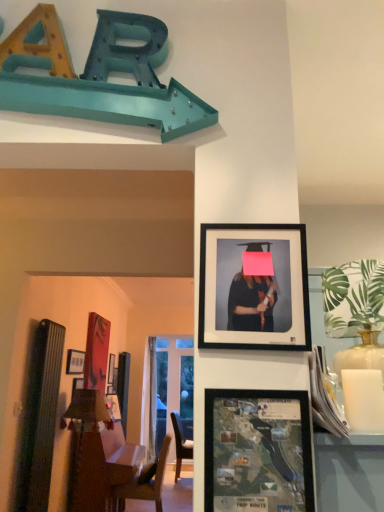
What do you see at coordinates (254, 287) in the screenshot?
I see `matte black frame at upper center, which is the third picture frame from bottom to top` at bounding box center [254, 287].

You are a GUI agent. You are given a task and a screenshot of the screen. Output one action in this format:
    pyautogui.click(x=<x>, y=<y>)
    Task: Click on the wooden bulletin board at left
    Image resolution: width=384 pixels, height=512 pixels.
    Given the screenshot: What is the action you would take?
    pyautogui.click(x=39, y=418)

Image resolution: width=384 pixels, height=512 pixels. What do you see at coordinates (258, 451) in the screenshot? I see `matte plastic map at center, which appears as the third picture frame when viewed from the back` at bounding box center [258, 451].

Find the location of a particular element. Image resolution: width=384 pixels, height=512 pixels. matte black frame at upper center, the 2th picture frame from the back is located at coordinates (254, 287).

Is matte plastic map at center, the 2th picture frame in the bottom-to-top sequence, taller or shorter than matte black frame at upper center, which is the third picture frame from bottom to top?

matte plastic map at center, the 2th picture frame in the bottom-to-top sequence, is shorter than matte black frame at upper center, which is the third picture frame from bottom to top.

Is matte plastic map at center, which is the first picture frame from front to back, next to matte black frame at upper center, marked as the 2th picture frame in a front-to-back arrangement?

matte plastic map at center, which is the first picture frame from front to back, and matte black frame at upper center, marked as the 2th picture frame in a front-to-back arrangement, are not in contact.

Relative to matte black frame at upper center, positioned as the first picture frame in top-to-bottom order, is matte plastic map at center, which appears as the 2th picture frame when viewed from the top, in front or behind?

In the image, matte plastic map at center, which appears as the 2th picture frame when viewed from the top, appears in front of matte black frame at upper center, positioned as the first picture frame in top-to-bottom order.

From the image's perspective, would you say matte plastic map at center, which appears as the third picture frame when viewed from the back, is positioned over matte black frame at upper center, positioned as the 1th picture frame in right-to-left order?

No, from the image's perspective, matte plastic map at center, which appears as the third picture frame when viewed from the back, is not on top of matte black frame at upper center, positioned as the 1th picture frame in right-to-left order.

Is matte black frame at upper center, positioned as the 1th picture frame in right-to-left order, wider or thinner than matte black picture frame at upper left, positioned as the 1th picture frame in bottom-to-top order?

Clearly, matte black frame at upper center, positioned as the 1th picture frame in right-to-left order, has less width compared to matte black picture frame at upper left, positioned as the 1th picture frame in bottom-to-top order.

From the image's perspective, does matte black frame at upper center, marked as the 2th picture frame in a front-to-back arrangement, appear lower than matte black picture frame at upper left, marked as the third picture frame in a top-to-bottom arrangement?

No.

The width and height of the screenshot is (384, 512). Find the location of `picture frame that is the 2nd one when counting leftward from the matte black frame at upper center, which is the third picture frame from bottom to top`. picture frame that is the 2nd one when counting leftward from the matte black frame at upper center, which is the third picture frame from bottom to top is located at coordinates (75, 362).

Based on the photo, does matte black frame at upper center, positioned as the first picture frame in top-to-bottom order, turn towards matte black picture frame at upper left, which appears as the first picture frame when viewed from the back?

No, matte black frame at upper center, positioned as the first picture frame in top-to-bottom order, does not turn towards matte black picture frame at upper left, which appears as the first picture frame when viewed from the back.

Based on the photo, is matte black picture frame at upper left, which appears as the first picture frame when viewed from the back, thinner than matte plastic map at center, which is the first picture frame from front to back?

In fact, matte black picture frame at upper left, which appears as the first picture frame when viewed from the back, might be wider than matte plastic map at center, which is the first picture frame from front to back.

Based on the photo, is matte black picture frame at upper left, marked as the third picture frame in a top-to-bottom arrangement, aimed at matte plastic map at center, which appears as the third picture frame when viewed from the back?

No.

Is matte black picture frame at upper left, positioned as the 1th picture frame in bottom-to-top order, touching matte plastic map at center, the 2th picture frame when ordered from left to right?

matte black picture frame at upper left, positioned as the 1th picture frame in bottom-to-top order, is not next to matte plastic map at center, the 2th picture frame when ordered from left to right, and they're not touching.

Is matte black picture frame at upper left, marked as the third picture frame in a top-to-bottom arrangement, at the right side of matte plastic map at center, which is the first picture frame from front to back?

No, matte black picture frame at upper left, marked as the third picture frame in a top-to-bottom arrangement, is not to the right of matte plastic map at center, which is the first picture frame from front to back.

From a real-world perspective, between wooden bulletin board at left and matte plastic map at center, which is the first picture frame from front to back, who is vertically higher?

From a 3D spatial view, matte plastic map at center, which is the first picture frame from front to back, is above.

Is wooden bulletin board at left further to the viewer compared to matte plastic map at center, which appears as the 2th picture frame when viewed from the top?

Yes, wooden bulletin board at left is further from the camera.

Can you tell me how much wooden bulletin board at left and matte plastic map at center, the 2th picture frame when ordered from left to right, differ in facing direction?

There is a 91.2-degree angle between the facing directions of wooden bulletin board at left and matte plastic map at center, the 2th picture frame when ordered from left to right.

Does matte plastic map at center, which appears as the third picture frame when viewed from the back, turn towards wooden bulletin board at left?

No, matte plastic map at center, which appears as the third picture frame when viewed from the back, is not facing towards wooden bulletin board at left.

Looking at this image, between matte plastic map at center, which is the 2th picture frame in right-to-left order, and wooden bulletin board at left, which one has less height?

matte plastic map at center, which is the 2th picture frame in right-to-left order.

From a real-world perspective, who is located higher, matte plastic map at center, which is the 2th picture frame in right-to-left order, or wooden bulletin board at left?

matte plastic map at center, which is the 2th picture frame in right-to-left order, is physically above.

Is point (234, 396) less distant than point (40, 383)?

That is True.

Find the location of `bulletin board on the right of matte black picture frame at upper left, which appears as the first picture frame when viewed from the back`. bulletin board on the right of matte black picture frame at upper left, which appears as the first picture frame when viewed from the back is located at coordinates (39, 418).

Is point (69, 364) in front of point (33, 428)?

No, (69, 364) is behind (33, 428).

Does matte black picture frame at upper left, marked as the third picture frame in a top-to-bottom arrangement, appear on the right side of wooden bulletin board at left?

No.

Can you tell me how much matte black picture frame at upper left, the third picture frame viewed from the front, and wooden bulletin board at left differ in facing direction?

They differ by 1.91 degrees in their facing directions.

Is matte plastic map at center, which appears as the 2th picture frame when viewed from the top, taller than matte black picture frame at upper left, marked as the third picture frame in a top-to-bottom arrangement?

Yes.

Is matte plastic map at center, which is the 2th picture frame in right-to-left order, touching matte black picture frame at upper left, the third picture frame viewed from the front?

No, matte plastic map at center, which is the 2th picture frame in right-to-left order, is not making contact with matte black picture frame at upper left, the third picture frame viewed from the front.

Can you confirm if matte plastic map at center, which appears as the 2th picture frame when viewed from the top, is wider than matte black picture frame at upper left, marked as the 1th picture frame in a left-to-right arrangement?

Incorrect, the width of matte plastic map at center, which appears as the 2th picture frame when viewed from the top, does not surpass that of matte black picture frame at upper left, marked as the 1th picture frame in a left-to-right arrangement.

The image size is (384, 512). In order to click on the 1st picture frame behind the matte plastic map at center, which is the 2th picture frame in right-to-left order, starting your count from the anchor in this screenshot , I will do tap(254, 287).

From the image's perspective, count 2nd picture frames upward from the matte black picture frame at upper left, which appears as the first picture frame when viewed from the back, and point to it. Please provide its 2D coordinates.

[(254, 287)]

Based on their spatial positions, is matte plastic map at center, the 2th picture frame in the bottom-to-top sequence, or matte black frame at upper center, the 2th picture frame from the back, closer to matte black picture frame at upper left, acting as the third picture frame starting from the right?

matte black frame at upper center, the 2th picture frame from the back, is positioned closer to the anchor matte black picture frame at upper left, acting as the third picture frame starting from the right.

Looking at the image, which one is located closer to matte black picture frame at upper left, marked as the third picture frame in a top-to-bottom arrangement, matte black frame at upper center, the third picture frame positioned from the left, or matte plastic map at center, which is the 2th picture frame in right-to-left order?

matte black frame at upper center, the third picture frame positioned from the left, is positioned closer to the anchor matte black picture frame at upper left, marked as the third picture frame in a top-to-bottom arrangement.

Based on their spatial positions, is matte black frame at upper center, the third picture frame positioned from the left, or matte plastic map at center, which appears as the third picture frame when viewed from the back, closer to wooden bulletin board at left?

matte black frame at upper center, the third picture frame positioned from the left.

Which object lies further to the anchor point wooden bulletin board at left, matte black picture frame at upper left, which appears as the first picture frame when viewed from the back, or matte plastic map at center, which is the 2th picture frame in right-to-left order?

matte plastic map at center, which is the 2th picture frame in right-to-left order.

Considering their positions, is wooden bulletin board at left positioned closer to matte black picture frame at upper left, which appears as the first picture frame when viewed from the back, than matte plastic map at center, which is the first picture frame from front to back?

The object closer to matte black picture frame at upper left, which appears as the first picture frame when viewed from the back, is wooden bulletin board at left.

Looking at the image, which one is located closer to matte plastic map at center, which appears as the 2th picture frame when viewed from the top, matte black picture frame at upper left, the third picture frame viewed from the front, or wooden bulletin board at left?

wooden bulletin board at left is closer to matte plastic map at center, which appears as the 2th picture frame when viewed from the top.

Which object lies further to the anchor point matte black frame at upper center, positioned as the first picture frame in top-to-bottom order, wooden bulletin board at left or matte black picture frame at upper left, which appears as the first picture frame when viewed from the back?

matte black picture frame at upper left, which appears as the first picture frame when viewed from the back, is positioned further to the anchor matte black frame at upper center, positioned as the first picture frame in top-to-bottom order.

When comparing their distances from wooden bulletin board at left, does matte black picture frame at upper left, positioned as the 1th picture frame in bottom-to-top order, or matte black frame at upper center, marked as the 2th picture frame in a front-to-back arrangement, seem further?

Among the two, matte black frame at upper center, marked as the 2th picture frame in a front-to-back arrangement, is located further to wooden bulletin board at left.

In order to click on picture frame between matte plastic map at center, which is the 2th picture frame in right-to-left order, and wooden bulletin board at left in the front-back direction in this screenshot , I will do `click(254, 287)`.

The width and height of the screenshot is (384, 512). I want to click on bulletin board positioned between matte black frame at upper center, which is the third picture frame from bottom to top, and matte black picture frame at upper left, acting as the third picture frame starting from the right, from near to far, so click(39, 418).

Where is `picture frame between matte plastic map at center, which is the 2th picture frame in right-to-left order, and matte black picture frame at upper left, marked as the third picture frame in a top-to-bottom arrangement, from front to back`? The image size is (384, 512). picture frame between matte plastic map at center, which is the 2th picture frame in right-to-left order, and matte black picture frame at upper left, marked as the third picture frame in a top-to-bottom arrangement, from front to back is located at coordinates (254, 287).

What are the coordinates of `bulletin board between matte plastic map at center, the 2th picture frame when ordered from left to right, and matte black picture frame at upper left, which appears as the first picture frame when viewed from the back, in the front-back direction` in the screenshot? It's located at (39, 418).